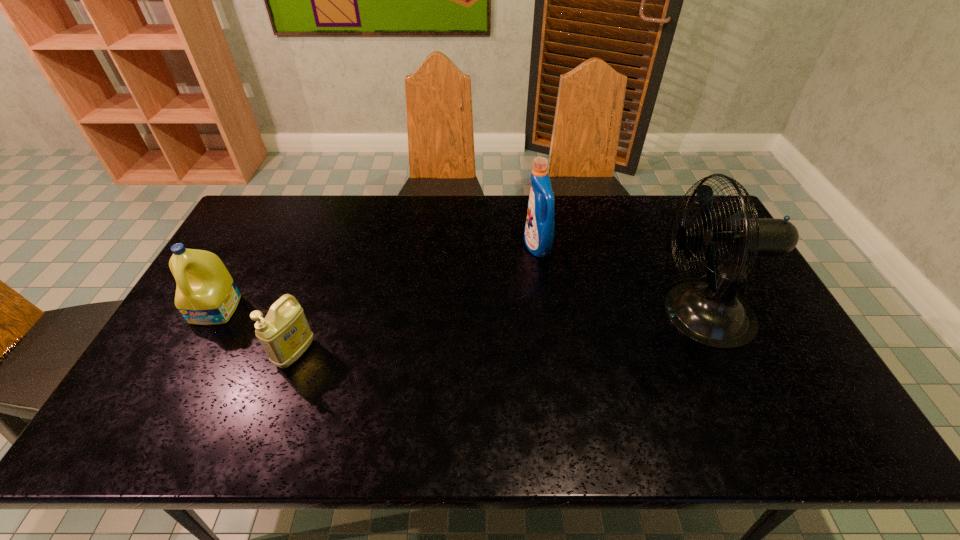
Image resolution: width=960 pixels, height=540 pixels. Find the location of `free space that satisfies the following two spatial constraints: 1. on the label of the rightmost detergent; 2. on the front side of the shortest object`. free space that satisfies the following two spatial constraints: 1. on the label of the rightmost detergent; 2. on the front side of the shortest object is located at coordinates (552, 353).

Where is `vacant region that satisfies the following two spatial constraints: 1. on the label of the shortest detergent; 2. on the left side of the leftmost detergent`? Image resolution: width=960 pixels, height=540 pixels. vacant region that satisfies the following two spatial constraints: 1. on the label of the shortest detergent; 2. on the left side of the leftmost detergent is located at coordinates (193, 353).

Find the location of `vacant space that satisfies the following two spatial constraints: 1. on the label of the farthest detergent; 2. on the label of the second nearest detergent`. vacant space that satisfies the following two spatial constraints: 1. on the label of the farthest detergent; 2. on the label of the second nearest detergent is located at coordinates (546, 309).